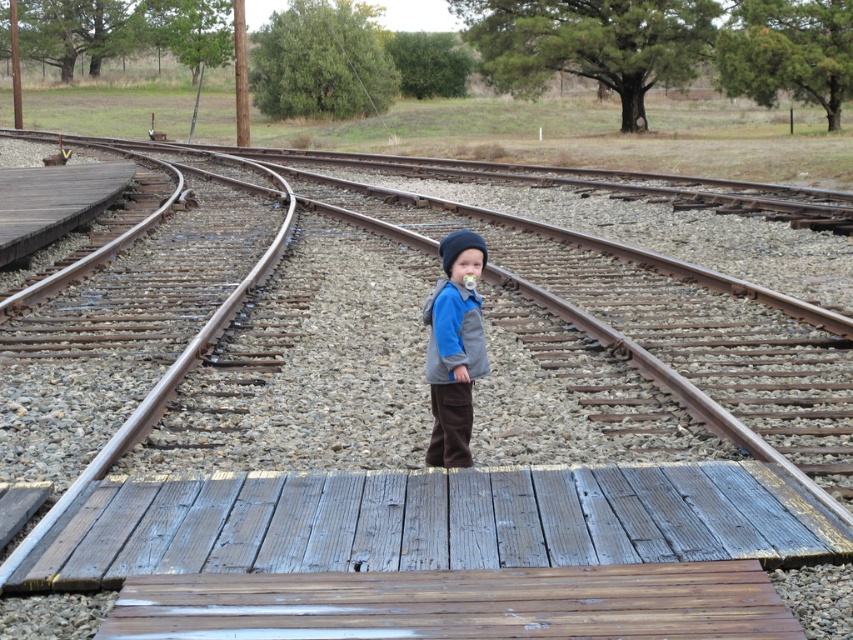
Question: Does rusty metal track at center lie in front of brown suede vest at center?

Choices:
 (A) yes
 (B) no

Answer: (A)

Question: Does rusty metal track at center appear over brown suede vest at center?

Choices:
 (A) yes
 (B) no

Answer: (A)

Question: Does rusty metal track at center have a lesser width compared to brown suede vest at center?

Choices:
 (A) no
 (B) yes

Answer: (A)

Question: Which point is closer to the camera?

Choices:
 (A) pyautogui.click(x=556, y=256)
 (B) pyautogui.click(x=467, y=428)

Answer: (B)

Question: Among these points, which one is farthest from the camera?

Choices:
 (A) (453, 246)
 (B) (605, 525)

Answer: (A)

Question: Which object is farther from the camera taking this photo?

Choices:
 (A) rusty metal track at center
 (B) brown suede vest at center

Answer: (B)